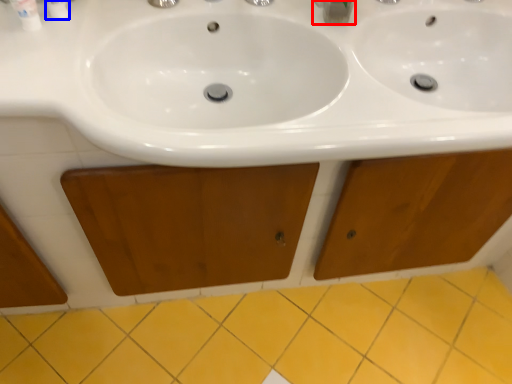
Question: Which of the following is the farthest to the observer, plumbing fixture (highlighted by a red box) or toiletry (highlighted by a blue box)?

Choices:
 (A) plumbing fixture
 (B) toiletry

Answer: (A)